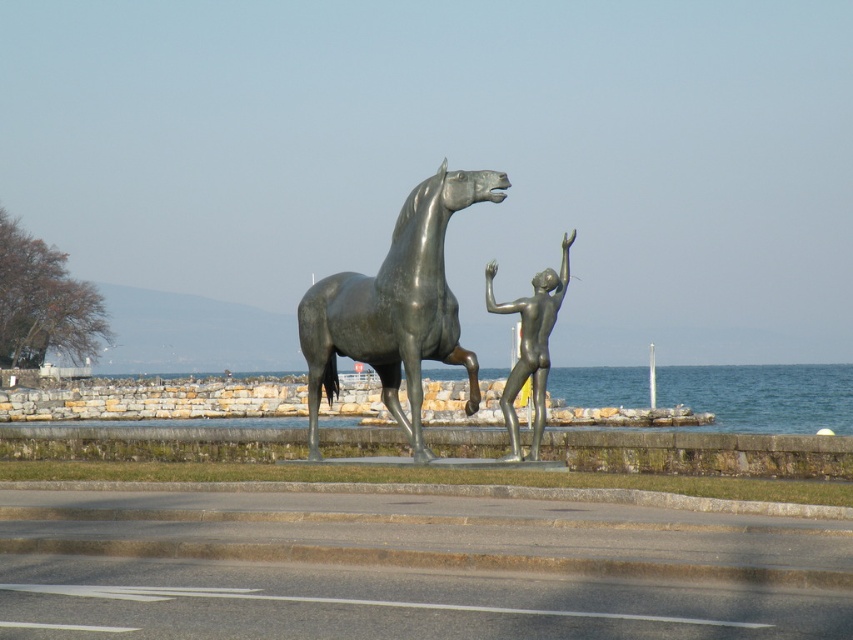
Question: Which point appears closest to the camera in this image?

Choices:
 (A) pos(372,321)
 (B) pos(563,252)

Answer: (A)

Question: Among these objects, which one is nearest to the camera?

Choices:
 (A) bronze horse at center
 (B) bronze nude figure at center

Answer: (A)

Question: Is bronze horse at center wider than bronze nude figure at center?

Choices:
 (A) yes
 (B) no

Answer: (A)

Question: Observing the image, what is the correct spatial positioning of bronze horse at center in reference to bronze nude figure at center?

Choices:
 (A) above
 (B) below

Answer: (A)

Question: Does bronze horse at center have a greater width compared to bronze nude figure at center?

Choices:
 (A) no
 (B) yes

Answer: (B)